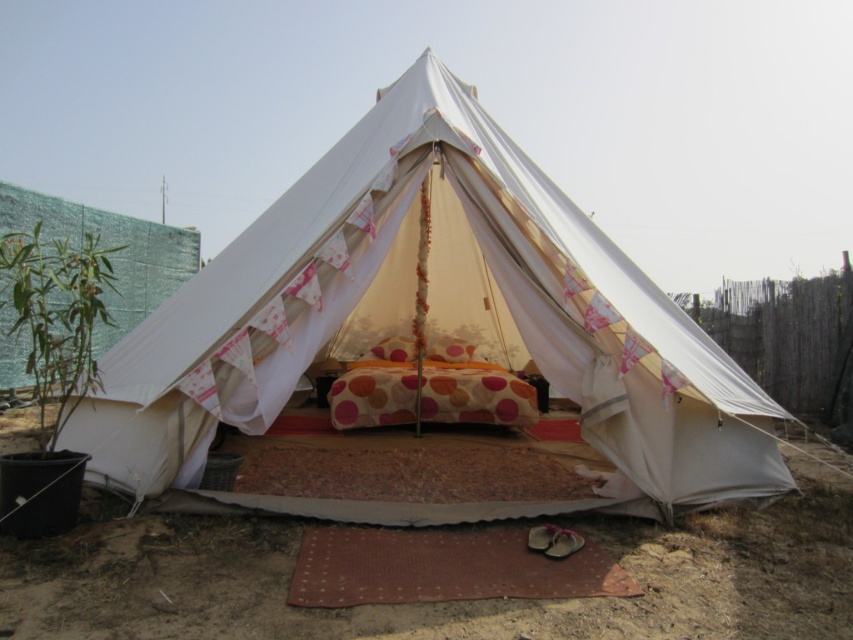
Question: Is the position of white canvas tent at center less distant than that of brown sandy dirt at lower center?

Choices:
 (A) yes
 (B) no

Answer: (B)

Question: Which point appears closest to the camera in this image?

Choices:
 (A) (9, 602)
 (B) (662, 298)

Answer: (A)

Question: Among these points, which one is nearest to the camera?

Choices:
 (A) (199, 300)
 (B) (811, 509)

Answer: (B)

Question: Is white canvas tent at center further to the viewer compared to brown sandy dirt at lower center?

Choices:
 (A) yes
 (B) no

Answer: (A)

Question: Can you confirm if white canvas tent at center is thinner than brown sandy dirt at lower center?

Choices:
 (A) yes
 (B) no

Answer: (B)